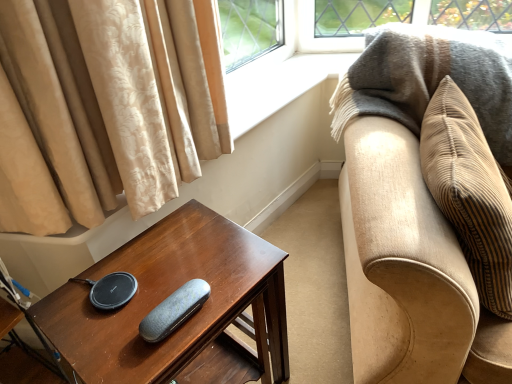
Question: Considering the relative positions of dark brown wood table at lower left and beige corduroy couch at right in the image provided, is dark brown wood table at lower left to the left or to the right of beige corduroy couch at right?

Choices:
 (A) left
 (B) right

Answer: (A)

Question: From the image's perspective, is dark brown wood table at lower left above or below beige corduroy couch at right?

Choices:
 (A) below
 (B) above

Answer: (A)

Question: Which object is positioned closest to the beige corduroy pillow at right?

Choices:
 (A) dark brown wood table at lower left
 (B) beige corduroy couch at right
 (C) textured gray case at center

Answer: (B)

Question: Which object is the closest to the textured gray case at center?

Choices:
 (A) beige corduroy couch at right
 (B) dark brown wood table at lower left
 (C) beige corduroy pillow at right

Answer: (B)